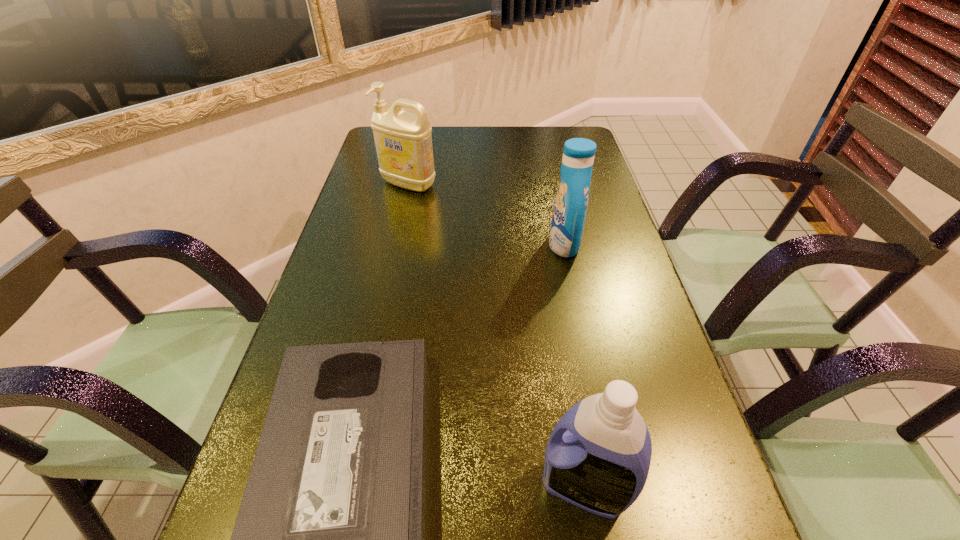
Identify the location of the farthest detergent. (403, 141).

Locate an element on the screen. The width and height of the screenshot is (960, 540). the leftmost detergent is located at coordinates (403, 141).

At what (x,y) coordinates should I click in order to perform the action: click on the second farthest detergent. Please return your answer as a coordinate pair (x, y). Looking at the image, I should click on (570, 207).

Find the location of a particular element. Image resolution: width=960 pixels, height=540 pixels. the nearest detergent is located at coordinates pyautogui.click(x=598, y=456).

I want to click on blank space located on the right of the farthest object, so click(567, 184).

You are a GUI agent. You are given a task and a screenshot of the screen. Output one action in this format:
    pyautogui.click(x=<x>, y=<y>)
    Task: Click on the free space located on the front-facing side of the second farthest detergent
    
    Given the screenshot: What is the action you would take?
    pyautogui.click(x=486, y=245)

Find the location of a particular element. Image resolution: width=960 pixels, height=540 pixels. vacant space located 0.110m on the front-facing side of the second farthest detergent is located at coordinates (506, 245).

The image size is (960, 540). Find the location of `vacant space located on the front-facing side of the second farthest detergent`. vacant space located on the front-facing side of the second farthest detergent is located at coordinates (396, 245).

Locate an element on the screen. The width and height of the screenshot is (960, 540). vacant region located on the back of the nearest detergent is located at coordinates (553, 297).

The image size is (960, 540). In order to click on object situated at the left edge in this screenshot , I will do `click(403, 141)`.